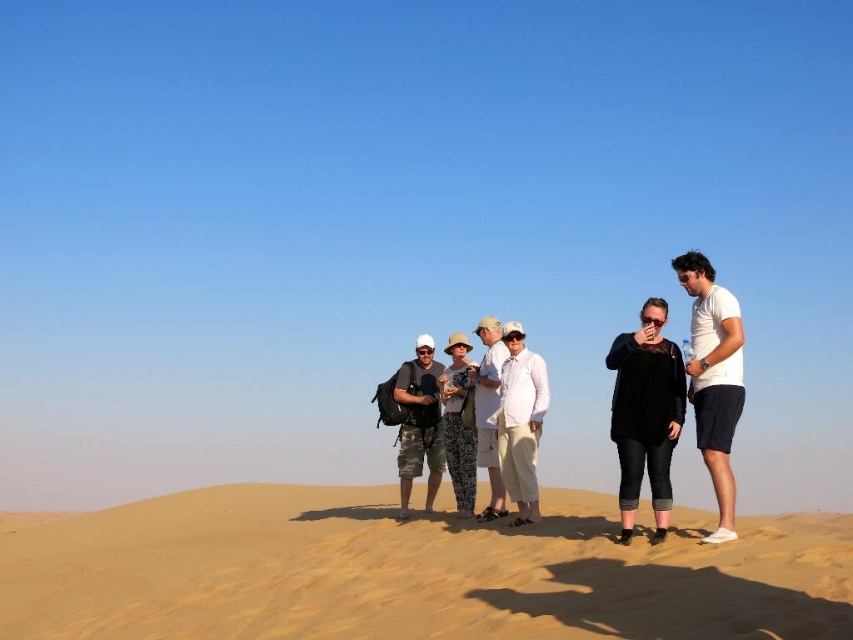
Question: Is black lace top at center positioned before white cotton t-shirt at right?

Choices:
 (A) yes
 (B) no

Answer: (B)

Question: Estimate the real-world distances between objects in this image. Which object is closer to the camo fabric shorts at center?

Choices:
 (A) white cotton t-shirt at right
 (B) printed fabric hat at center
 (C) fine-grained sand at center

Answer: (B)

Question: Estimate the real-world distances between objects in this image. Which object is closer to the light beige cotton pants at center?

Choices:
 (A) camo fabric shorts at center
 (B) printed fabric hat at center

Answer: (B)

Question: Which is farther from the white cotton t-shirt at right?

Choices:
 (A) printed fabric hat at center
 (B) white textured shirt at center
 (C) fine-grained sand at center
 (D) black lace top at center

Answer: (A)

Question: Is light beige cotton pants at center wider than camo fabric shorts at center?

Choices:
 (A) yes
 (B) no

Answer: (B)

Question: Can you confirm if camo fabric shorts at center is positioned above printed fabric hat at center?

Choices:
 (A) no
 (B) yes

Answer: (A)